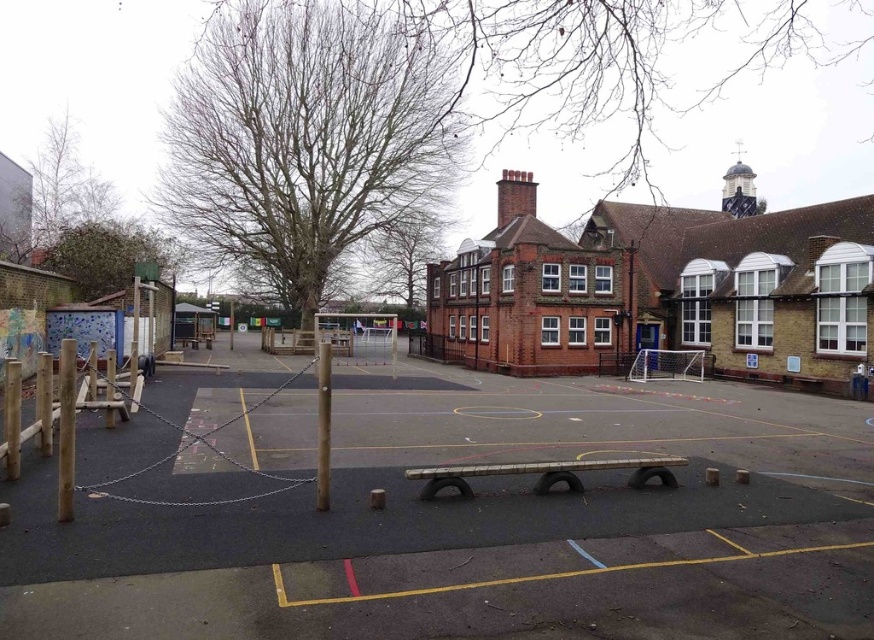
Is wooden pole at left closer to the viewer compared to wooden pole at center?

Yes, it is.

Does point (61, 385) come farther from viewer compared to point (316, 497)?

No, (61, 385) is closer to viewer.

Locate an element on the screen. The height and width of the screenshot is (640, 874). wooden pole at left is located at coordinates (66, 429).

Can you confirm if smooth asphalt parking lot at center is shorter than wooden pole at center?

Correct, smooth asphalt parking lot at center is not as tall as wooden pole at center.

Who is higher up, smooth asphalt parking lot at center or wooden pole at center?

wooden pole at center

Locate an element on the screen. The width and height of the screenshot is (874, 640). smooth asphalt parking lot at center is located at coordinates (484, 525).

Does smooth asphalt parking lot at center have a lesser height compared to wooden pole at left?

Yes, smooth asphalt parking lot at center is shorter than wooden pole at left.

Can you confirm if smooth asphalt parking lot at center is positioned below wooden pole at left?

Yes, smooth asphalt parking lot at center is below wooden pole at left.

Does point (241, 477) come behind point (71, 349)?

Yes, it is behind point (71, 349).

Locate an element on the screen. smooth asphalt parking lot at center is located at coordinates (484, 525).